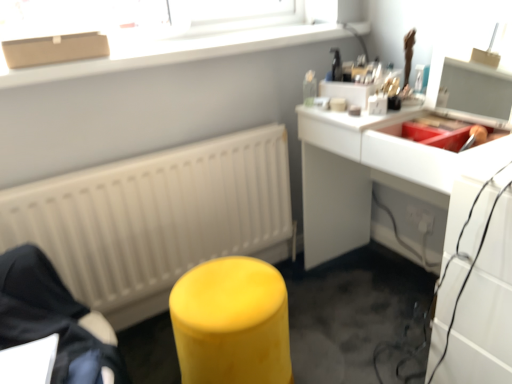
Question: Can you confirm if white plastic electric outlet at lower right is positioned to the left of white glossy desk at upper right?

Choices:
 (A) yes
 (B) no

Answer: (B)

Question: Is white plastic electric outlet at lower right in front of white glossy desk at upper right?

Choices:
 (A) no
 (B) yes

Answer: (A)

Question: Does white plastic electric outlet at lower right have a lesser width compared to white glossy desk at upper right?

Choices:
 (A) yes
 (B) no

Answer: (A)

Question: Does white plastic electric outlet at lower right have a smaller size compared to white glossy desk at upper right?

Choices:
 (A) no
 (B) yes

Answer: (B)

Question: Can you see white plastic electric outlet at lower right touching white glossy desk at upper right?

Choices:
 (A) no
 (B) yes

Answer: (A)

Question: Can you confirm if white plastic electric outlet at lower right is wider than white glossy desk at upper right?

Choices:
 (A) yes
 (B) no

Answer: (B)

Question: From a real-world perspective, is matte yellow stool at lower left, the 2th furniture from the right, positioned over matte white radiator at center based on gravity?

Choices:
 (A) no
 (B) yes

Answer: (B)

Question: Is matte white radiator at center inside matte yellow stool at lower left, which appears as the first furniture when viewed from the left?

Choices:
 (A) yes
 (B) no

Answer: (B)

Question: Considering the relative sizes of matte yellow stool at lower left, which appears as the first furniture when viewed from the left, and matte white radiator at center in the image provided, is matte yellow stool at lower left, which appears as the first furniture when viewed from the left, bigger than matte white radiator at center?

Choices:
 (A) yes
 (B) no

Answer: (B)

Question: Does matte yellow stool at lower left, which appears as the first furniture when viewed from the left, have a greater height compared to matte white radiator at center?

Choices:
 (A) no
 (B) yes

Answer: (A)

Question: Is matte yellow stool at lower left, the 2th furniture from the right, far away from matte white radiator at center?

Choices:
 (A) yes
 (B) no

Answer: (B)

Question: From the image's perspective, is matte yellow stool at lower left, which appears as the first furniture when viewed from the left, below matte white radiator at center?

Choices:
 (A) yes
 (B) no

Answer: (A)

Question: Is white plastic electric outlet at lower right completely or partially outside of matte yellow stool at lower left, which appears as the first furniture when viewed from the left?

Choices:
 (A) yes
 (B) no

Answer: (A)